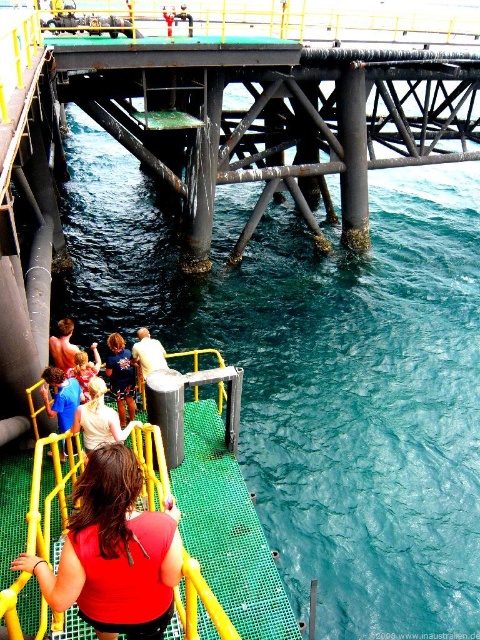
You are a photographer trying to capture a photo of the blue denim shorts at lower left and the light brown leather jacket at lower center. Which object should you focus on first if you want to ensure both are in frame without moving the camera?

The blue denim shorts at lower left is larger in size than the light brown leather jacket at lower center, so you should focus on the blue denim shorts at lower left first to ensure it fits within the frame before adjusting for the smaller jacket.

You are a safety inspector on the offshore platform. You notice the green mesh platform at center and the light brown leather jacket at lower center. Which object takes up more space in the image?

The light brown leather jacket at lower center takes up more space in the image than the green mesh platform at center, as it is larger in size.